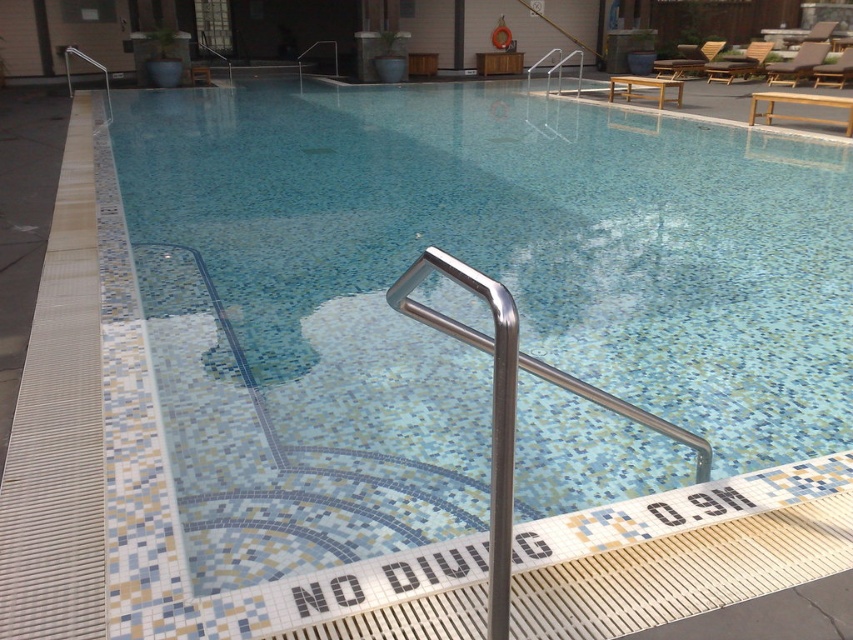
Question: Which point appears farthest from the camera in this image?

Choices:
 (A) (704, 444)
 (B) (397, 470)

Answer: (B)

Question: In this image, where is blue mosaic tile pool at center located relative to polished stainless steel handrail at center?

Choices:
 (A) below
 (B) above

Answer: (B)

Question: Can you confirm if blue mosaic tile pool at center is thinner than polished stainless steel handrail at center?

Choices:
 (A) yes
 (B) no

Answer: (B)

Question: Among these objects, which one is nearest to the camera?

Choices:
 (A) blue mosaic tile pool at center
 (B) polished stainless steel handrail at center

Answer: (B)

Question: Does blue mosaic tile pool at center appear on the left side of polished stainless steel handrail at center?

Choices:
 (A) no
 (B) yes

Answer: (B)